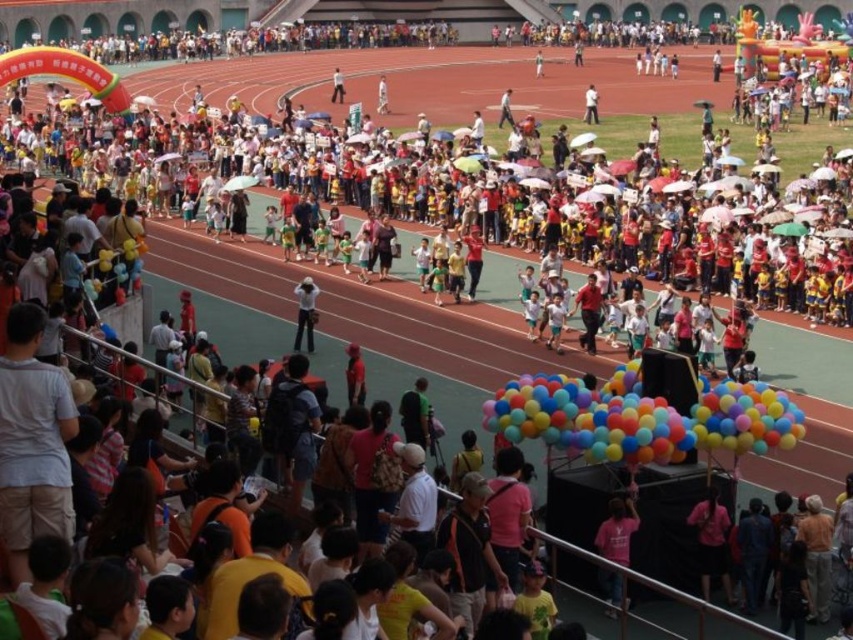
Can you confirm if multicolored balloons at center is shorter than matte white hat at center?

In fact, multicolored balloons at center may be taller than matte white hat at center.

Can you confirm if multicolored balloons at center is positioned above matte white hat at center?

Actually, multicolored balloons at center is below matte white hat at center.

Is point (796, 420) less distant than point (309, 333)?

That is True.

Find the location of a particular element. The height and width of the screenshot is (640, 853). multicolored balloons at center is located at coordinates (642, 417).

Does point (628, 552) come closer to viewer compared to point (306, 340)?

That is True.

Locate an element on the screen. The image size is (853, 640). pink matte shirt at center is located at coordinates (618, 531).

How much distance is there between pink fabric shirt at lower right and pink matte shirt at center?

They are 4.09 meters apart.

Measure the distance between pink fabric shirt at lower right and pink matte shirt at center.

4.09 meters

Who is more forward, (700, 508) or (610, 572)?

Point (610, 572)

Locate an element on the screen. pink fabric shirt at lower right is located at coordinates (712, 541).